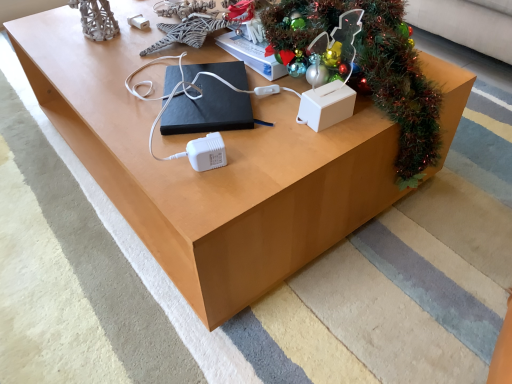
The height and width of the screenshot is (384, 512). Identify the location of vacant space to the right of white plastic tissue box at center-right. (376, 112).